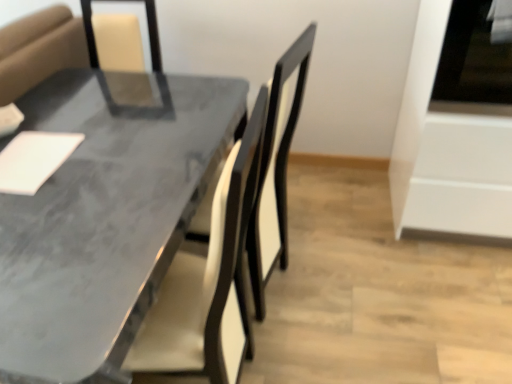
The height and width of the screenshot is (384, 512). I want to click on free space to the left of white glossy oven at right, so click(348, 225).